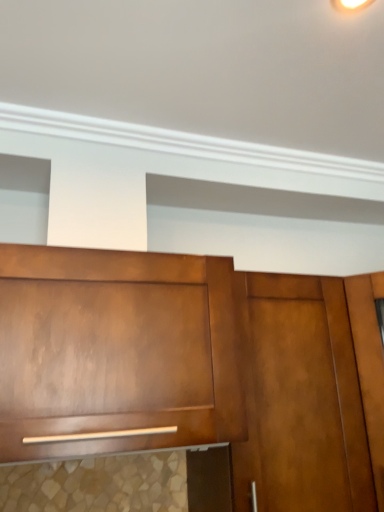
Question: Should I look upward or downward to see satin wood door at center?

Choices:
 (A) down
 (B) up

Answer: (A)

Question: Is matte wood cabinet at center thinner than satin wood door at center?

Choices:
 (A) no
 (B) yes

Answer: (A)

Question: Considering the relative sizes of matte wood cabinet at center and satin wood door at center in the image provided, is matte wood cabinet at center bigger than satin wood door at center?

Choices:
 (A) no
 (B) yes

Answer: (B)

Question: Is matte wood cabinet at center turned away from satin wood door at center?

Choices:
 (A) no
 (B) yes

Answer: (A)

Question: From the image's perspective, is matte wood cabinet at center over satin wood door at center?

Choices:
 (A) no
 (B) yes

Answer: (B)

Question: Can you confirm if matte wood cabinet at center is shorter than satin wood door at center?

Choices:
 (A) yes
 (B) no

Answer: (A)

Question: Is matte wood cabinet at center at the left side of satin wood door at center?

Choices:
 (A) yes
 (B) no

Answer: (A)

Question: Is satin wood door at center behind matte wood cabinet at center?

Choices:
 (A) yes
 (B) no

Answer: (A)

Question: Is satin wood door at center taller than matte wood cabinet at center?

Choices:
 (A) yes
 (B) no

Answer: (A)

Question: Is satin wood door at center bigger than matte wood cabinet at center?

Choices:
 (A) no
 (B) yes

Answer: (A)

Question: Can you confirm if satin wood door at center is shorter than matte wood cabinet at center?

Choices:
 (A) no
 (B) yes

Answer: (A)

Question: Can you confirm if satin wood door at center is thinner than matte wood cabinet at center?

Choices:
 (A) yes
 (B) no

Answer: (A)

Question: Is satin wood door at center facing away from matte wood cabinet at center?

Choices:
 (A) no
 (B) yes

Answer: (A)

Question: From a real-world perspective, is matte wood cabinet at center above or below satin wood door at center?

Choices:
 (A) below
 (B) above

Answer: (B)